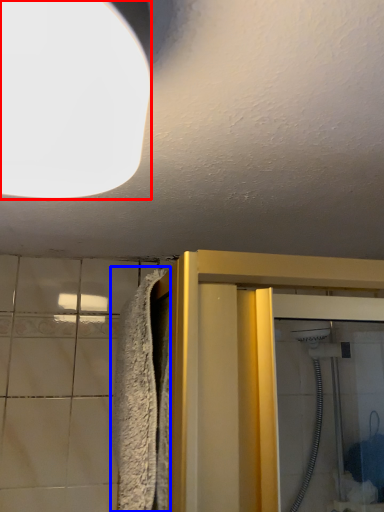
Question: Which object is closer to the camera taking this photo, lighting (highlighted by a red box) or bath towel (highlighted by a blue box)?

Choices:
 (A) lighting
 (B) bath towel

Answer: (A)